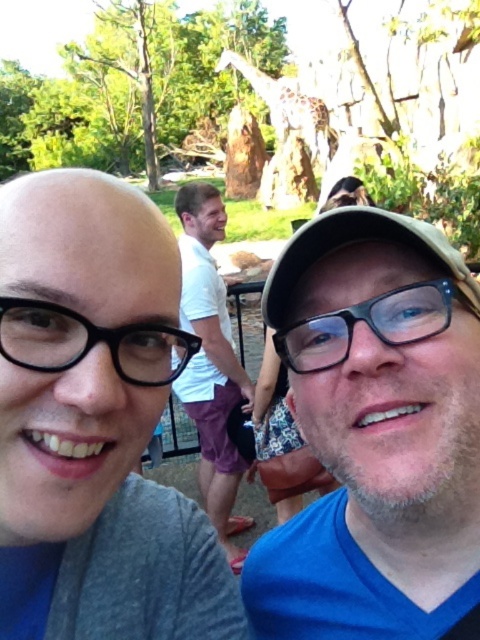
You are a zoo visitor who wants to take a photo of the giraffe. You have two pairs of black plastic glasses in your bag. The first pair is the black plastic glasses at left, and the second pair is the black plastic glasses at center. Which pair of glasses should you choose to ensure they are visible in the photo without being too small?

You should choose the black plastic glasses at center because it is larger than the black plastic glasses at left, making it more visible in the photo.

You are a photographer trying to capture a closeup of the black plastic glasses at left without including the gray matte shirt at upper left in the frame. Given their relative sizes, is this possible?

The gray matte shirt at upper left is wider than the black plastic glasses at left, so it might be challenging to frame the glasses without including the shirt, especially if they are positioned closely together in the scene.

You are standing at the point marked by coordinates point (x=211, y=362). What object is exactly at that location?

The white cotton shirt at center is located at point (x=211, y=362).